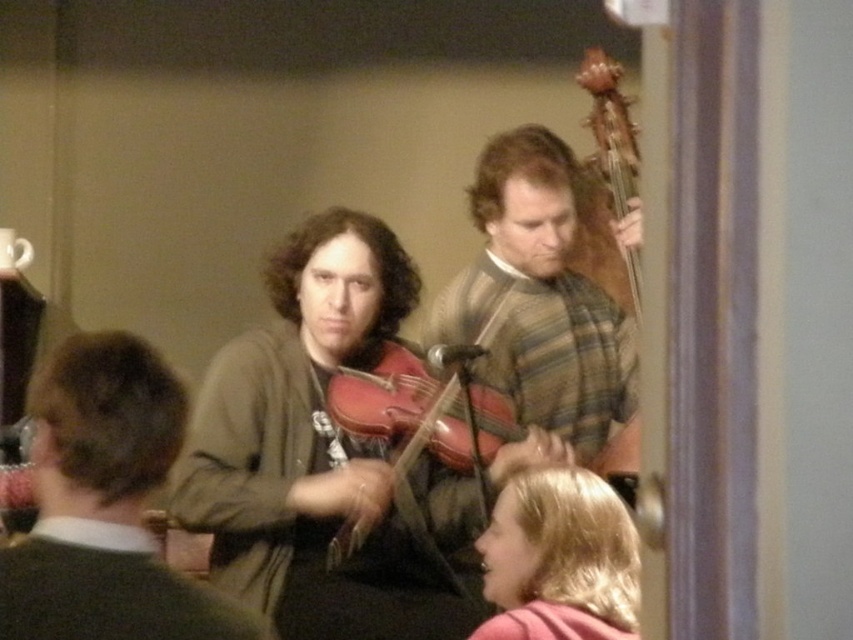
Question: Can you confirm if blonde hair at lower right is positioned to the left of matte wood violin at center?

Choices:
 (A) no
 (B) yes

Answer: (A)

Question: Among these points, which one is farthest from the camera?

Choices:
 (A) (524, 262)
 (B) (346, 410)
 (C) (531, 605)

Answer: (A)

Question: Does matte brown violin at center lie behind matte wood violin at center?

Choices:
 (A) no
 (B) yes

Answer: (A)

Question: Estimate the real-world distances between objects in this image. Which object is closer to the matte brown violin at center?

Choices:
 (A) matte wood violin at center
 (B) striped wool sweater at center

Answer: (A)

Question: Which object is closer to the camera taking this photo?

Choices:
 (A) striped wool sweater at center
 (B) blonde hair at lower right
 (C) matte wood violin at center
 (D) matte brown violin at center

Answer: (D)

Question: Is matte brown violin at center above matte wood violin at center?

Choices:
 (A) no
 (B) yes

Answer: (B)